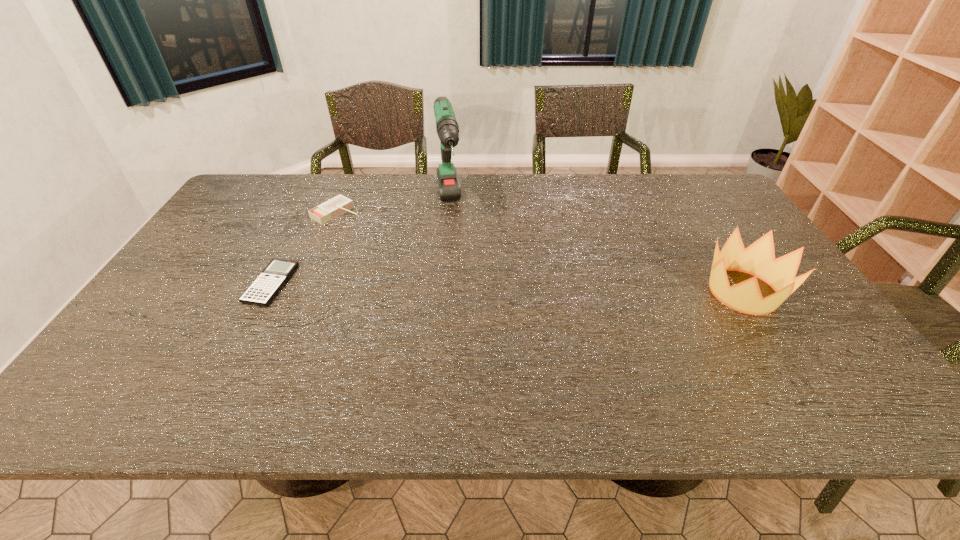
At what (x,y) coordinates should I click in order to perform the action: click on the shortest object. Please return your answer as a coordinate pair (x, y). Image resolution: width=960 pixels, height=540 pixels. Looking at the image, I should click on (266, 286).

Image resolution: width=960 pixels, height=540 pixels. Identify the location of the rightmost object. (758, 259).

Image resolution: width=960 pixels, height=540 pixels. I want to click on the second tallest object, so click(x=758, y=259).

The width and height of the screenshot is (960, 540). Identify the location of the second shortest object. (340, 204).

In order to click on the tallest object in this screenshot , I will do `click(447, 127)`.

Identify the location of the third object from left to right. The image size is (960, 540). click(x=447, y=127).

Locate an element on the screen. This screenshot has height=540, width=960. vacant area located 0.380m on the right of the calculator is located at coordinates (434, 284).

Identify the location of vacant area situated on the left of the rightmost object. The image size is (960, 540). (641, 292).

The image size is (960, 540). What are the coordinates of `vacant area situated 0.260m on the striking surface of the second shortest object` in the screenshot? It's located at (409, 252).

The image size is (960, 540). Identify the location of vacant space located on the striking surface of the second shortest object. (392, 243).